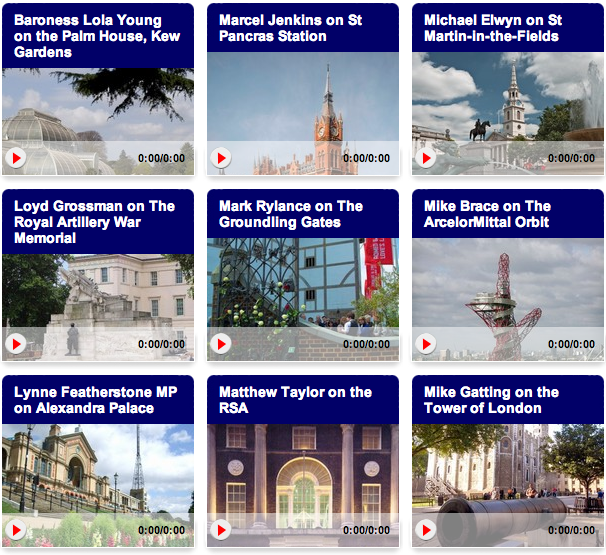
Image resolution: width=606 pixels, height=555 pixels. I want to click on chandelier, so click(303, 519).